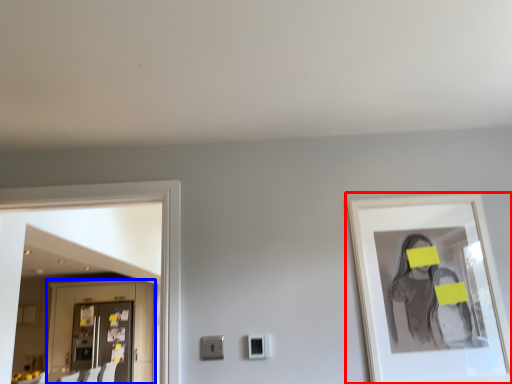
Question: Among these objects, which one is nearest to the camera, picture frame (highlighted by a red box) or cabinetry (highlighted by a blue box)?

Choices:
 (A) picture frame
 (B) cabinetry

Answer: (A)